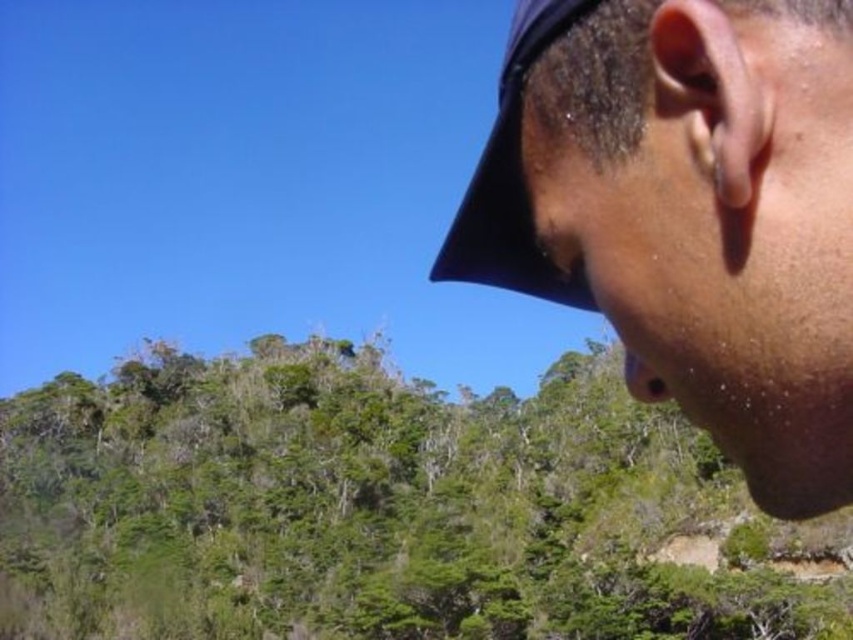
Can you confirm if matte black cap at upper right is shorter than black fabric baseball hat at upper right?

Incorrect, matte black cap at upper right's height does not fall short of black fabric baseball hat at upper right's.

Does matte black cap at upper right appear on the right side of black fabric baseball hat at upper right?

Indeed, matte black cap at upper right is positioned on the right side of black fabric baseball hat at upper right.

Identify the location of matte black cap at upper right. This screenshot has width=853, height=640. (688, 212).

Locate an element on the screen. matte black cap at upper right is located at coordinates (688, 212).

Locate an element on the screen. green leafy trees at center is located at coordinates (386, 509).

Between green leafy trees at center and black fabric baseball hat at upper right, which one has less height?

With less height is black fabric baseball hat at upper right.

What do you see at coordinates (386, 509) in the screenshot?
I see `green leafy trees at center` at bounding box center [386, 509].

Image resolution: width=853 pixels, height=640 pixels. Find the location of `green leafy trees at center`. green leafy trees at center is located at coordinates (386, 509).

How far apart are green leafy trees at center and matte black cap at upper right?

green leafy trees at center is 97.15 feet from matte black cap at upper right.

Which is in front, point (0, 570) or point (573, 83)?

Point (573, 83) is in front.

Who is more forward, (498,452) or (637,236)?

Point (637,236) is more forward.

The height and width of the screenshot is (640, 853). What are the coordinates of `green leafy trees at center` in the screenshot? It's located at (386, 509).